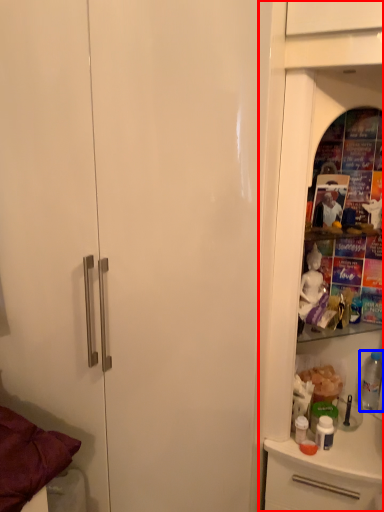
Question: Which object is further to the camera taking this photo, dresser (highlighted by a red box) or bottle (highlighted by a blue box)?

Choices:
 (A) dresser
 (B) bottle

Answer: (B)